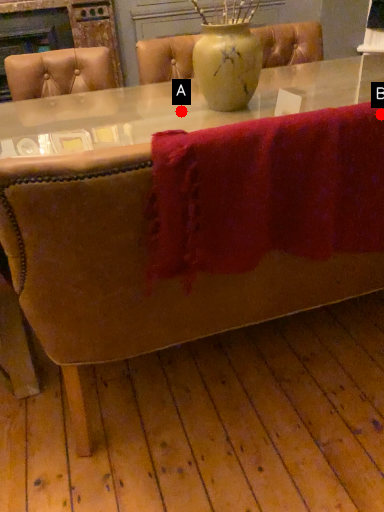
Question: Two points are circled on the image, labeled by A and B beside each circle. Among these points, which one is farthest from the camera?

Choices:
 (A) A is further
 (B) B is further

Answer: (A)